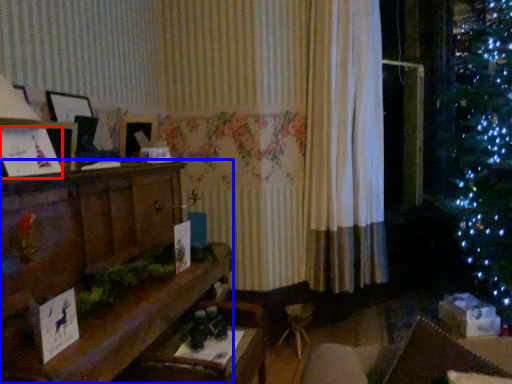
Question: Which object appears closest to the camera in this image, christmas card (highlighted by a red box) or furniture (highlighted by a blue box)?

Choices:
 (A) christmas card
 (B) furniture

Answer: (B)